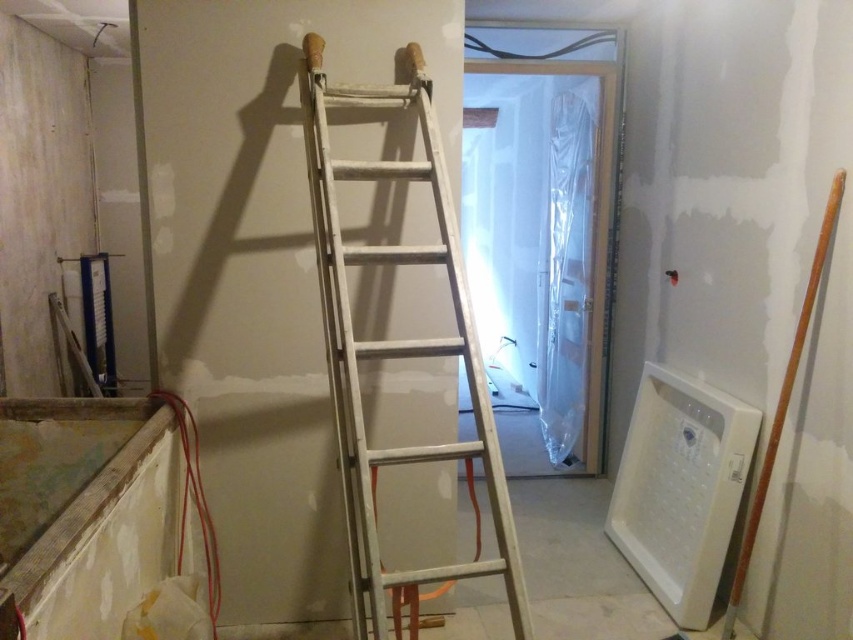
Is white wooden ladder at center bigger than metallic silver ladder at upper center?

Correct, white wooden ladder at center is larger in size than metallic silver ladder at upper center.

In the scene shown: Does white wooden ladder at center come in front of metallic silver ladder at upper center?

Yes, white wooden ladder at center is closer to the viewer.

Describe the element at coordinates (396, 346) in the screenshot. This screenshot has height=640, width=853. I see `white wooden ladder at center` at that location.

Identify the location of white wooden ladder at center. The image size is (853, 640). (396, 346).